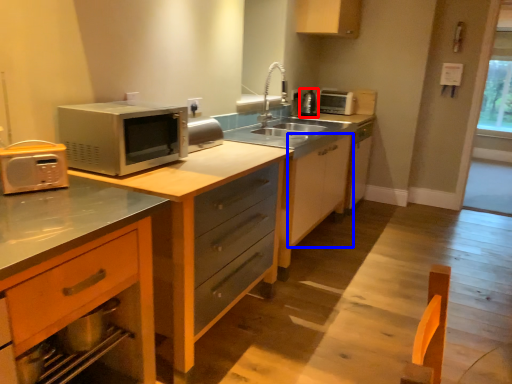
Question: Among these objects, which one is farthest to the camera, appliance (highlighted by a red box) or cabinetry (highlighted by a blue box)?

Choices:
 (A) appliance
 (B) cabinetry

Answer: (A)